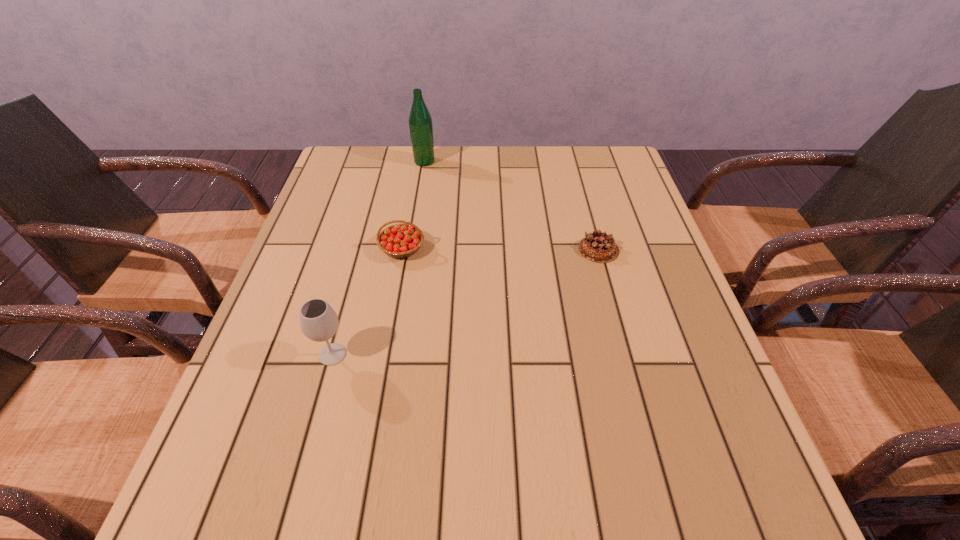
Where is `the farthest object`? This screenshot has width=960, height=540. the farthest object is located at coordinates (420, 122).

The image size is (960, 540). Identify the location of the tallest object. (420, 122).

Where is `wineglass`? The width and height of the screenshot is (960, 540). wineglass is located at coordinates (319, 322).

Where is `the nearest object`? This screenshot has width=960, height=540. the nearest object is located at coordinates (319, 322).

Locate an element on the screen. The width and height of the screenshot is (960, 540). the second shortest object is located at coordinates (402, 240).

What are the coordinates of `chocolate cake` in the screenshot? It's located at click(598, 247).

Find the location of a particular element. the shortest object is located at coordinates (598, 247).

Identify the location of free spot located on the right of the farthest object. (556, 161).

This screenshot has width=960, height=540. Find the location of `vacant area situated 0.080m on the front of the wineglass`. vacant area situated 0.080m on the front of the wineglass is located at coordinates (318, 407).

I want to click on vacant space located 0.100m on the left of the second shortest object, so click(x=339, y=248).